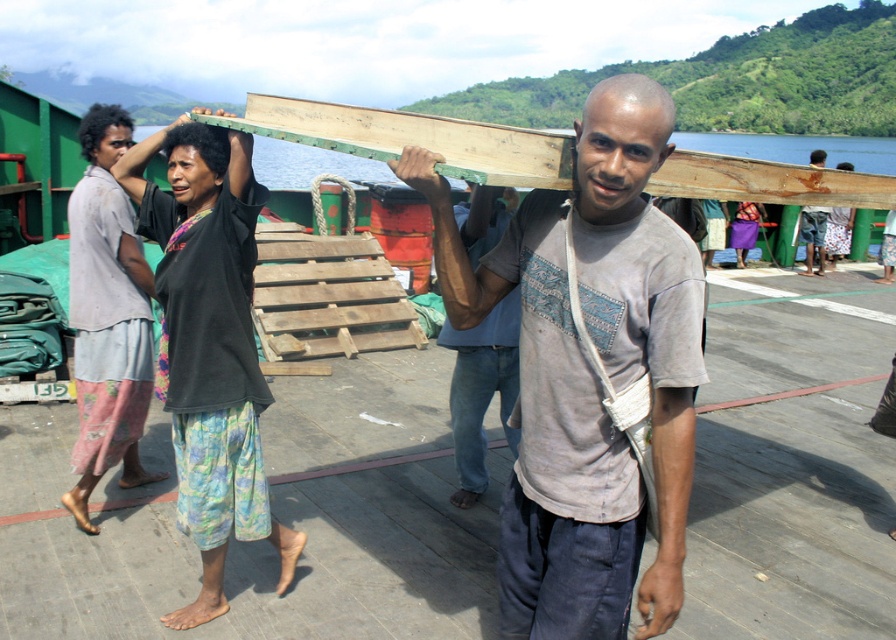
Which is more to the right, matte gray shirt at center or wooden plank at upper center?

wooden plank at upper center

Does point (642, 176) come in front of point (820, 250)?

Yes, it is in front of point (820, 250).

At what (x,y) coordinates should I click in order to perform the action: click on matte gray shirt at center. Please return your answer as a coordinate pair (x, y). The height and width of the screenshot is (640, 896). Looking at the image, I should click on (547, 432).

Who is more distant from viewer, (156, 221) or (810, 252)?

The point (810, 252) is more distant.

Can you confirm if black cotton shirt at upper center is positioned below wooden plank at upper center?

Indeed, black cotton shirt at upper center is positioned under wooden plank at upper center.

Identify the location of black cotton shirt at upper center. Image resolution: width=896 pixels, height=640 pixels. (210, 342).

I want to click on black cotton shirt at upper center, so click(210, 342).

Which of these two, matte gray shirt at center or gray cotton shirt at center, stands shorter?

gray cotton shirt at center is shorter.

Does matte gray shirt at center have a lesser height compared to gray cotton shirt at center?

No.

In the scene shown: Measure the distance between point (578, 196) and camera.

Point (578, 196) and camera are 1.92 meters apart.

This screenshot has width=896, height=640. Identify the location of matte gray shirt at center. (547, 432).